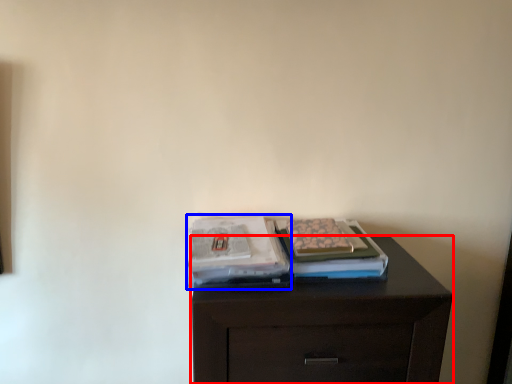
Question: Among these objects, which one is farthest to the camera, chest of drawers (highlighted by a red box) or magazine (highlighted by a blue box)?

Choices:
 (A) chest of drawers
 (B) magazine

Answer: (B)